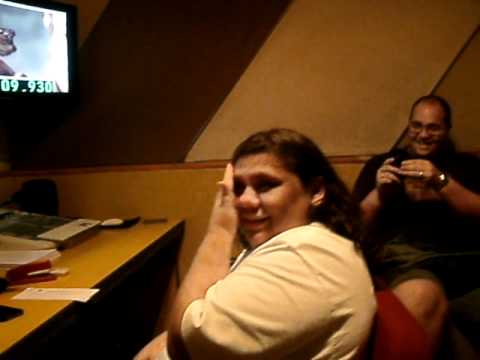
Where is `wall to the back`? wall to the back is located at coordinates (207, 185).